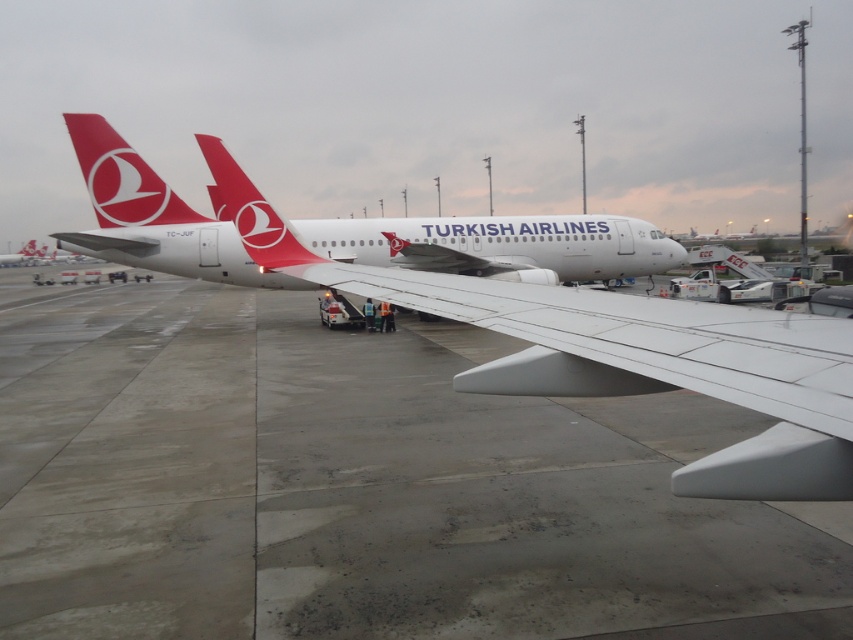
Question: Among these points, which one is nearest to the camera?

Choices:
 (A) (213, 160)
 (B) (625, 321)
 (C) (189, 205)

Answer: (B)

Question: Which point is farther from the camera taking this photo?

Choices:
 (A) 720,349
 (B) 561,570
 (C) 119,140
 (D) 91,237

Answer: (C)

Question: Can you confirm if white glossy airplane at center is wider than matte red tail at upper center?

Choices:
 (A) no
 (B) yes

Answer: (B)

Question: Can you confirm if white glossy airplane at center is thinner than matte red tail at upper center?

Choices:
 (A) yes
 (B) no

Answer: (B)

Question: Is concrete at center further to the viewer compared to white matte airplane at center?

Choices:
 (A) yes
 (B) no

Answer: (B)

Question: Which point is farther to the camera?

Choices:
 (A) white matte airplane at center
 (B) matte red airplane tail at center
 (C) matte red tail at upper center

Answer: (C)